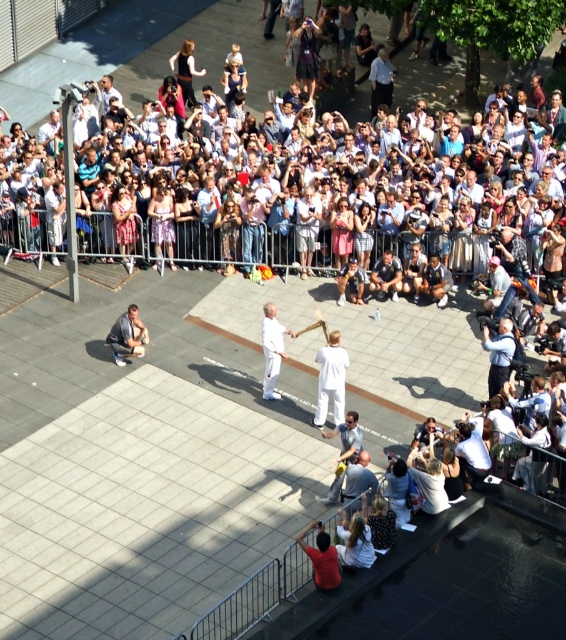
Question: Which of the following is the farthest from the observer?

Choices:
 (A) light brown leather jacket at lower left
 (B) light brown leather jacket at center

Answer: (B)

Question: Does light brown leather jacket at center have a larger size compared to light brown leather jacket at lower left?

Choices:
 (A) no
 (B) yes

Answer: (A)

Question: Which point is closer to the camera?

Choices:
 (A) light brown leather jacket at lower left
 (B) light brown leather jacket at center

Answer: (A)

Question: Is light brown leather jacket at center bigger than light brown leather jacket at lower left?

Choices:
 (A) yes
 (B) no

Answer: (B)

Question: Is light brown leather jacket at center positioned at the back of light brown leather jacket at lower left?

Choices:
 (A) yes
 (B) no

Answer: (A)